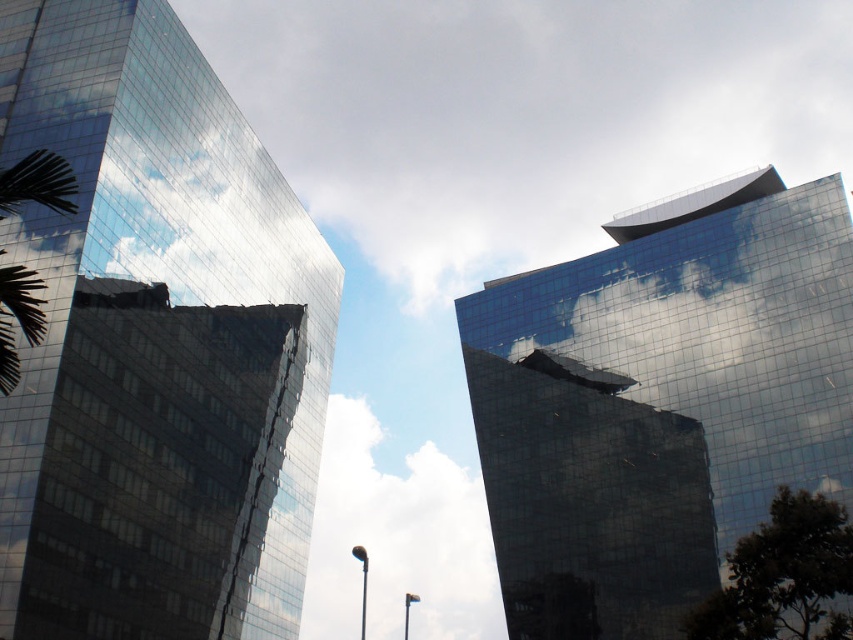
You are standing in front of the two skyscrapers and notice a white glossy cloud at upper center and a green leafy palm tree at left. Which object is positioned to the right of the other?

The white glossy cloud at upper center is positioned to the right of the green leafy palm tree at left.

You are standing at the base of the shiny glass building at upper right and want to see the top of the green leafy palm tree at left. Considering their heights, which one will you need to look up more to see?

The shiny glass building at upper right has a greater height compared to the green leafy palm tree at left. Therefore, you will need to look up more to see the top of the shiny glass building at upper right.

You are a drone operator who needs to fly a drone between the shiny glass building at left and the white fluffy cloud at center. The drone has a maximum flight distance of 100 meters. Can the drone safely fly between them without exceeding its range?

The distance between the shiny glass building at left and the white fluffy cloud at center is 86.21 meters, which is within the drone operator s maximum flight distance of 100 meters. Therefore, the drone can safely fly between them without exceeding its range.